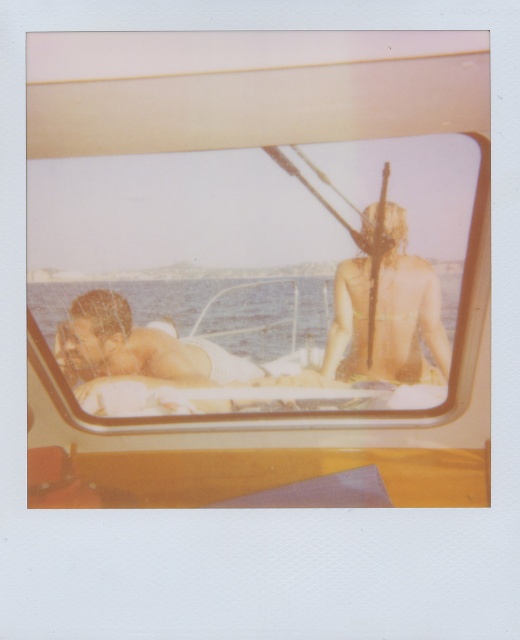
You are on a boat and need to dry off after swimming. You see a smooth white towel at center and golden tan skin at center. Which object is closer to your left side?

The smooth white towel at center is positioned on the left side of golden tan skin at center, so the smooth white towel at center is closer to your left side.

You are on a boat and want to reach the golden tan skin at center without stepping off the wooden boat at center. Can you do it?

The wooden boat at center is closer to the viewer than golden tan skin at center, so yes, you can reach the golden tan skin at center by moving towards it on the wooden boat at center.

Consider the image. You are a photographer on a boat and want to ensure the smooth white towel at center and golden tan skin at center are both visible in your shot. Given their sizes, which object should you focus on to include both without cropping?

The smooth white towel at center is shorter than golden tan skin at center, so focusing on the golden tan skin at center would allow both objects to fit in the frame since it is larger and can accommodate the smaller towel within the composition.